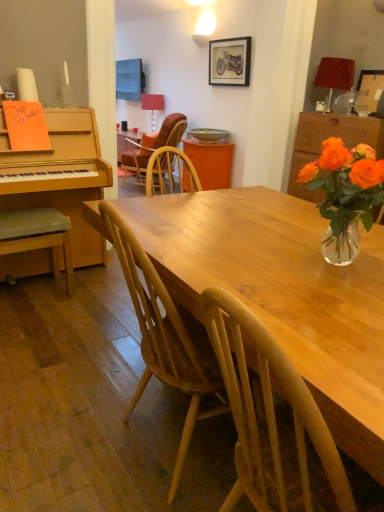
Question: Which direction should I rotate to look at matte red lampshade at upper center, the 2th lamp viewed from the front, — up or down?

Choices:
 (A) up
 (B) down

Answer: (A)

Question: Considering the relative sizes of light brown wooden table at center and wooden picture frame at upper right, which is the first picture frame from bottom to top, in the image provided, is light brown wooden table at center smaller than wooden picture frame at upper right, which is the first picture frame from bottom to top,?

Choices:
 (A) no
 (B) yes

Answer: (A)

Question: Is wooden picture frame at upper right, arranged as the 2th picture frame when viewed from the left, at the back of light brown wooden table at center?

Choices:
 (A) no
 (B) yes

Answer: (A)

Question: Considering the relative sizes of light brown wooden table at center and wooden picture frame at upper right, which is the first picture frame from bottom to top, in the image provided, is light brown wooden table at center wider than wooden picture frame at upper right, which is the first picture frame from bottom to top,?

Choices:
 (A) yes
 (B) no

Answer: (A)

Question: From a real-world perspective, is light brown wooden table at center physically below wooden picture frame at upper right, which is the first picture frame from bottom to top?

Choices:
 (A) no
 (B) yes

Answer: (B)

Question: Is light brown wooden table at center shorter than wooden picture frame at upper right, the first picture frame when ordered from right to left?

Choices:
 (A) no
 (B) yes

Answer: (A)

Question: From the image's perspective, is light brown wooden table at center under wooden picture frame at upper right, arranged as the 2th picture frame when viewed from the left?

Choices:
 (A) yes
 (B) no

Answer: (A)

Question: Is wooden textured chair at center, which is counted as the first chair, starting from the right, with wooden picture frame at upper center, which appears as the 2th picture frame when ordered from the bottom?

Choices:
 (A) yes
 (B) no

Answer: (B)

Question: From the image's perspective, would you say wooden textured chair at center, arranged as the first chair when viewed from the back, is shown under wooden picture frame at upper center, the first picture frame viewed from the top?

Choices:
 (A) no
 (B) yes

Answer: (B)

Question: Can you confirm if wooden textured chair at center, which is counted as the first chair, starting from the right, is taller than wooden picture frame at upper center, placed as the second picture frame when sorted from right to left?

Choices:
 (A) no
 (B) yes

Answer: (B)

Question: Is wooden textured chair at center, placed as the second chair when sorted from front to back, smaller than wooden picture frame at upper center, which is the 1th picture frame from back to front?

Choices:
 (A) no
 (B) yes

Answer: (A)

Question: Is wooden textured chair at center, arranged as the first chair when viewed from the back, oriented towards wooden picture frame at upper center, which is counted as the 1th picture frame, starting from the left?

Choices:
 (A) yes
 (B) no

Answer: (B)

Question: Is wooden textured chair at center, which is counted as the first chair, starting from the right, looking in the opposite direction of wooden picture frame at upper center, placed as the second picture frame when sorted from right to left?

Choices:
 (A) no
 (B) yes

Answer: (A)

Question: Does light brown wooden table at center have a larger size compared to wooden picture frame at upper center, placed as the second picture frame when sorted from right to left?

Choices:
 (A) no
 (B) yes

Answer: (B)